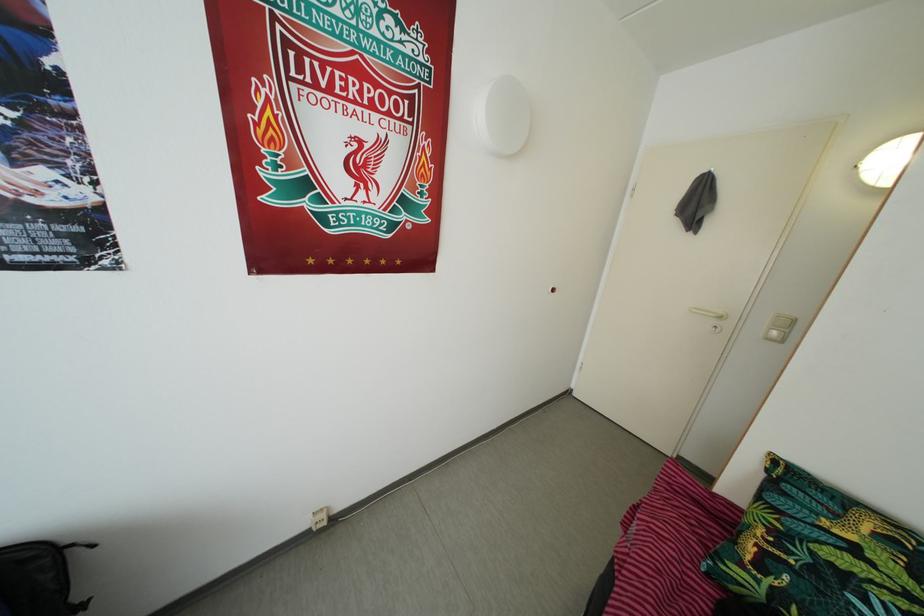
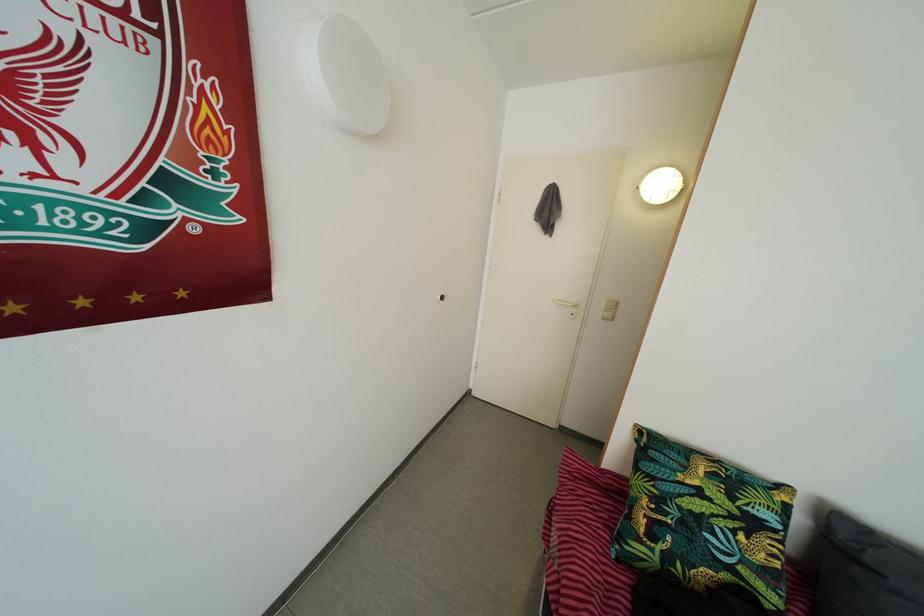
Question: The first image is from the beginning of the video and the second image is from the end. How did the camera likely rotate when shooting the video?

Choices:
 (A) Left
 (B) Right
 (C) Up
 (D) Down

Answer: (B)